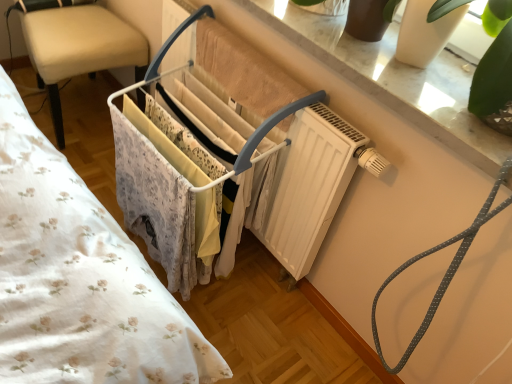
Question: Is white plastic clothes rack at center in front of gray dotted rope at upper right?

Choices:
 (A) no
 (B) yes

Answer: (A)

Question: Is white plastic clothes rack at center to the left of gray dotted rope at upper right from the viewer's perspective?

Choices:
 (A) yes
 (B) no

Answer: (A)

Question: Is white plastic clothes rack at center bigger than gray dotted rope at upper right?

Choices:
 (A) yes
 (B) no

Answer: (A)

Question: Are white plastic clothes rack at center and gray dotted rope at upper right making contact?

Choices:
 (A) no
 (B) yes

Answer: (A)

Question: Considering the relative sizes of white plastic clothes rack at center and gray dotted rope at upper right in the image provided, is white plastic clothes rack at center taller than gray dotted rope at upper right?

Choices:
 (A) yes
 (B) no

Answer: (B)

Question: Visually, is beige leather chair at left positioned to the left or to the right of white plastic clothes rack at center?

Choices:
 (A) right
 (B) left

Answer: (B)

Question: In terms of size, does beige leather chair at left appear bigger or smaller than white plastic clothes rack at center?

Choices:
 (A) small
 (B) big

Answer: (A)

Question: Choose the correct answer: Is beige leather chair at left inside white plastic clothes rack at center or outside it?

Choices:
 (A) outside
 (B) inside

Answer: (A)

Question: From the image's perspective, is beige leather chair at left located above or below white plastic clothes rack at center?

Choices:
 (A) below
 (B) above

Answer: (B)

Question: From their relative heights in the image, would you say white marble window sill at upper center is taller or shorter than white plastic clothes rack at center?

Choices:
 (A) short
 (B) tall

Answer: (A)

Question: From the image's perspective, is white marble window sill at upper center positioned above or below white plastic clothes rack at center?

Choices:
 (A) below
 (B) above

Answer: (B)

Question: Based on their sizes in the image, would you say white marble window sill at upper center is bigger or smaller than white plastic clothes rack at center?

Choices:
 (A) small
 (B) big

Answer: (A)

Question: From a real-world perspective, relative to white plastic clothes rack at center, is white marble window sill at upper center vertically above or below?

Choices:
 (A) above
 (B) below

Answer: (A)

Question: Is beige leather chair at left to the left or to the right of white marble window sill at upper center in the image?

Choices:
 (A) right
 (B) left

Answer: (B)

Question: From the image's perspective, relative to white marble window sill at upper center, is beige leather chair at left above or below?

Choices:
 (A) above
 (B) below

Answer: (A)